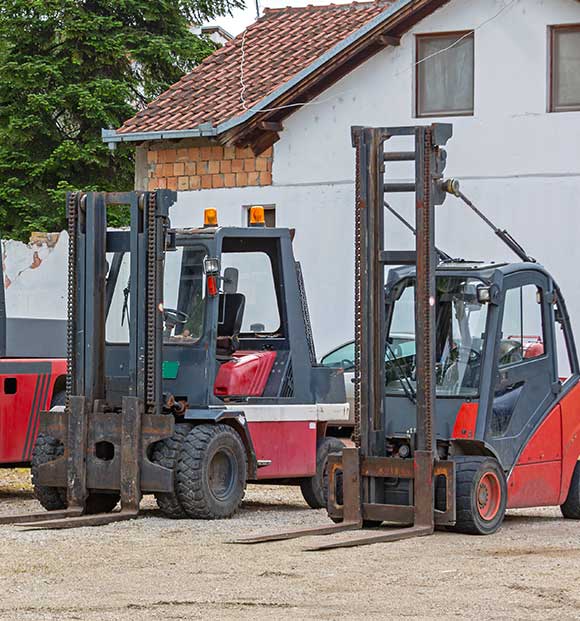
Image resolution: width=580 pixels, height=621 pixels. What are the coordinates of `forks` in the screenshot? It's located at (369, 540), (291, 530), (84, 518), (43, 514).